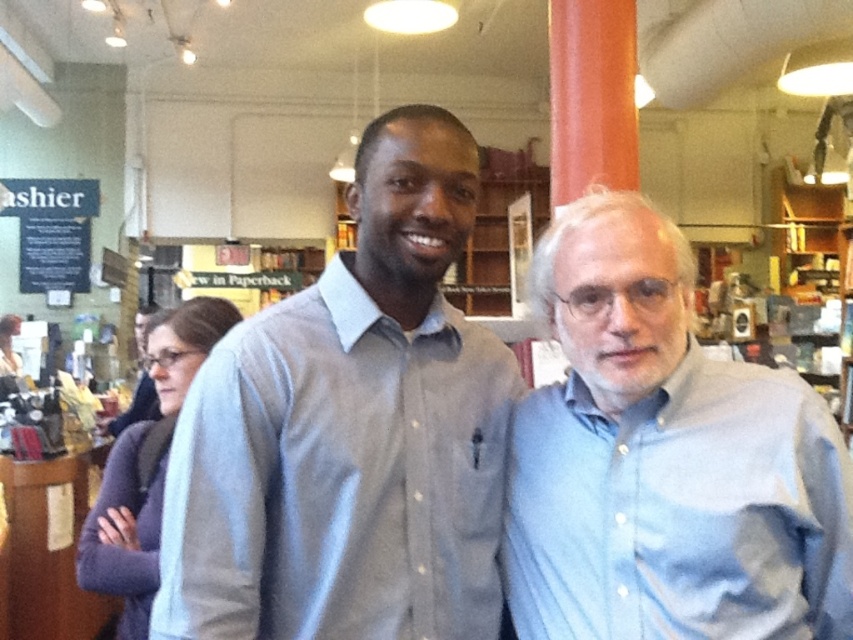
Between point (514, 433) and point (225, 301), which one is positioned behind?

The point (225, 301) is behind.

Who is more distant from viewer, (592,618) or (195,305)?

Positioned behind is point (195,305).

Where is `light blue button-down shirt at right`? light blue button-down shirt at right is located at coordinates (665, 460).

Can you confirm if gray button-down shirt at center is positioned below purple sweater at lower left?

No.

Between gray button-down shirt at center and purple sweater at lower left, which one appears on the left side from the viewer's perspective?

purple sweater at lower left

Where is `gray button-down shirt at center`? gray button-down shirt at center is located at coordinates (351, 432).

Identify the location of gray button-down shirt at center. This screenshot has width=853, height=640. (351, 432).

Between point (392, 280) and point (712, 376), which one is positioned in front?

Point (712, 376)

Who is more distant from viewer, (171, 502) or (834, 513)?

The point (834, 513) is behind.

I want to click on gray button-down shirt at center, so click(x=351, y=432).